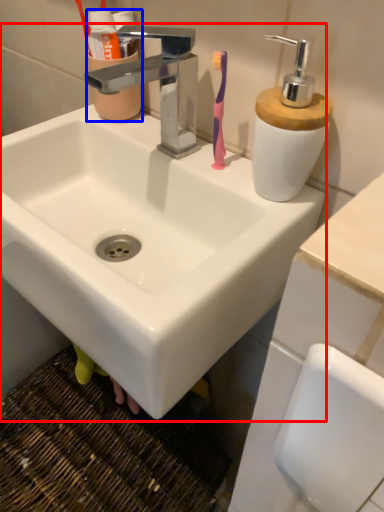
Question: Which object is further to the camera taking this photo, sink (highlighted by a red box) or mouthwash (highlighted by a blue box)?

Choices:
 (A) sink
 (B) mouthwash

Answer: (B)